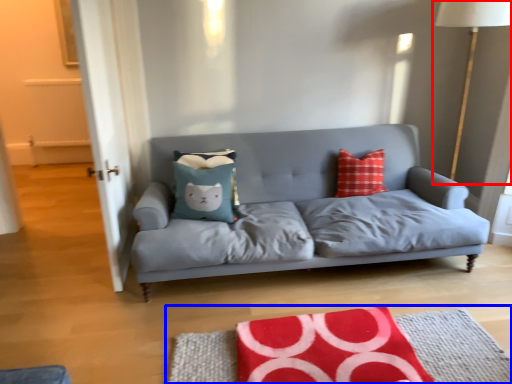
Question: Which object appears closest to the camera in this image, table lamp (highlighted by a red box) or mat (highlighted by a blue box)?

Choices:
 (A) table lamp
 (B) mat

Answer: (B)